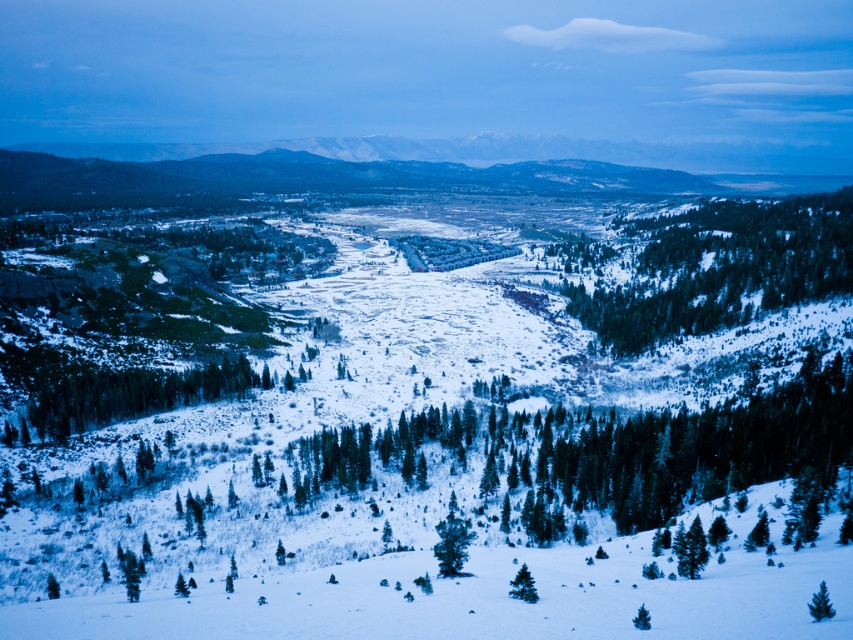
You are an observer standing in the winter landscape described. You notice two green matte trees in the foreground. Which one, the green matte tree at lower left or the green matte tree at lower center, is closer to you?

The green matte tree at lower left is closer to you because the green matte tree at lower center is positioned behind it.

You are standing in the winter landscape and want to walk from the point closer to you to the point farther away. Which path would you take between point (183, 371) and point (526, 580)?

You should walk from point (183, 371) to point (526, 580) because point (183, 371) is closer to you and point (526, 580) is farther away.

You are standing at the point marked as point (722, 268) in the winter landscape. What object is exactly at that location?

The green textured trees at center right are exactly at point (722, 268).